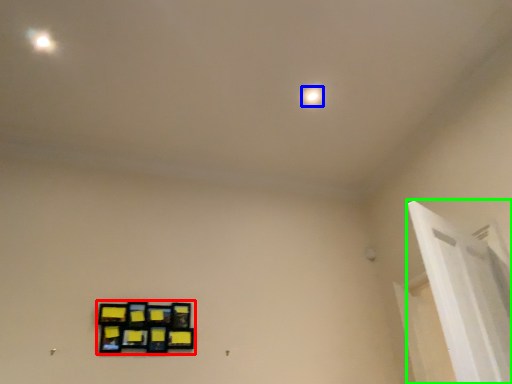
Question: Which object is the farthest from picture frame (highlighted by a red box)? Choose among these: dot (highlighted by a blue box) or window frame (highlighted by a green box).

Choices:
 (A) dot
 (B) window frame

Answer: (A)